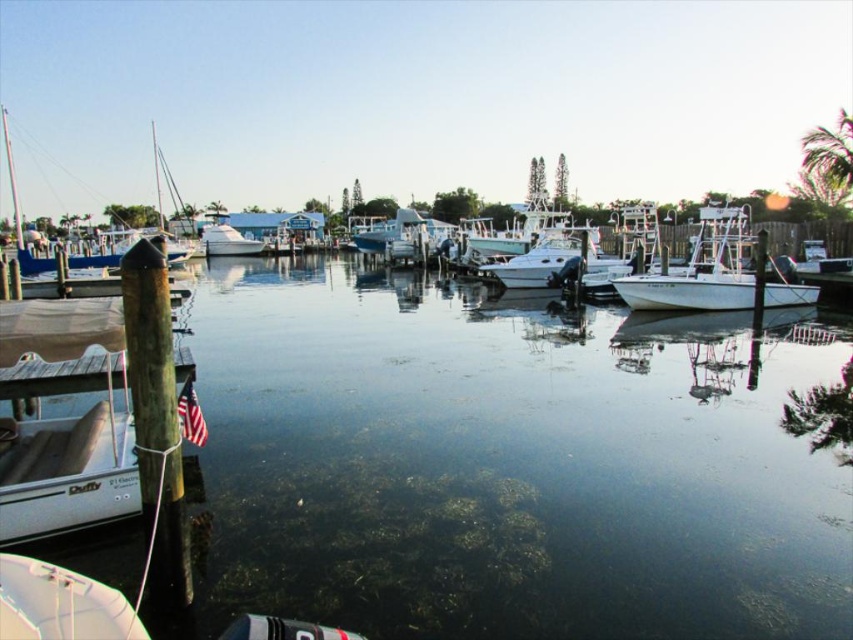
Who is shorter, white matte boat at right or white matte boat at lower left?

Standing shorter between the two is white matte boat at lower left.

Can you confirm if white matte boat at right is thinner than white matte boat at lower left?

No.

Is point (691, 241) in front of point (120, 616)?

No.

Find the location of `white matte boat at right`. white matte boat at right is located at coordinates (714, 273).

Looking at this image, does white fiberglass boat at center appear on the right side of white matte boat at center?

Correct, you'll find white fiberglass boat at center to the right of white matte boat at center.

What do you see at coordinates (402, 234) in the screenshot? I see `white fiberglass boat at center` at bounding box center [402, 234].

Between point (374, 248) and point (238, 252), which one is positioned behind?

Point (238, 252)

Where is `white fiberglass boat at center`? white fiberglass boat at center is located at coordinates (402, 234).

Is white glossy boat at center behind blue matte sailboat at left?

No, white glossy boat at center is in front of blue matte sailboat at left.

Which is in front, point (541, 284) or point (21, 246)?

Point (541, 284) is more forward.

Identify the location of white glossy boat at center. This screenshot has height=640, width=853. (550, 259).